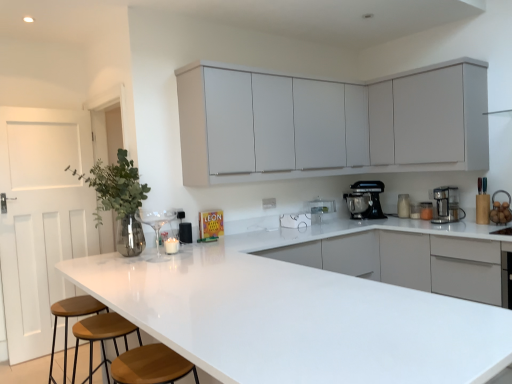
Question: Can you confirm if white matte cabinet at upper right, the first cabinetry viewed from the right, is shorter than silver metallic vase at left?

Choices:
 (A) yes
 (B) no

Answer: (B)

Question: Considering the relative sizes of white matte cabinet at upper right, the first cabinetry viewed from the right, and silver metallic vase at left in the image provided, is white matte cabinet at upper right, the first cabinetry viewed from the right, thinner than silver metallic vase at left?

Choices:
 (A) no
 (B) yes

Answer: (B)

Question: Is white matte cabinet at upper right, the first cabinetry viewed from the right, next to silver metallic vase at left?

Choices:
 (A) yes
 (B) no

Answer: (B)

Question: Is white matte cabinet at upper right, the 2th cabinetry viewed from the left, facing towards silver metallic vase at left?

Choices:
 (A) yes
 (B) no

Answer: (A)

Question: From the image's perspective, would you say white matte cabinet at upper right, the 2th cabinetry viewed from the left, is positioned over silver metallic vase at left?

Choices:
 (A) yes
 (B) no

Answer: (A)

Question: Considering the relative positions of white matte cabinet at upper right, the first cabinetry viewed from the right, and silver metallic vase at left in the image provided, is white matte cabinet at upper right, the first cabinetry viewed from the right, to the right of silver metallic vase at left from the viewer's perspective?

Choices:
 (A) no
 (B) yes

Answer: (B)

Question: From the image's perspective, is white glossy countertop at center over brown wooden stool at lower left, positioned as the second bar stool in back-to-front order?

Choices:
 (A) no
 (B) yes

Answer: (B)

Question: Does white glossy countertop at center lie in front of brown wooden stool at lower left, positioned as the second bar stool in back-to-front order?

Choices:
 (A) yes
 (B) no

Answer: (B)

Question: Is white glossy countertop at center thinner than brown wooden stool at lower left, the 1th bar stool positioned from the front?

Choices:
 (A) no
 (B) yes

Answer: (A)

Question: Can you confirm if white glossy countertop at center is bigger than brown wooden stool at lower left, positioned as the second bar stool in back-to-front order?

Choices:
 (A) no
 (B) yes

Answer: (B)

Question: From a real-world perspective, is white glossy countertop at center located higher than brown wooden stool at lower left, positioned as the second bar stool in back-to-front order?

Choices:
 (A) no
 (B) yes

Answer: (B)

Question: Does white glossy countertop at center have a greater width compared to brown wooden stool at lower left, positioned as the second bar stool in back-to-front order?

Choices:
 (A) no
 (B) yes

Answer: (B)

Question: From the image's perspective, is white glossy countertop at center on top of brown leather stool at lower left, which is counted as the first bar stool, starting from the back?

Choices:
 (A) no
 (B) yes

Answer: (B)